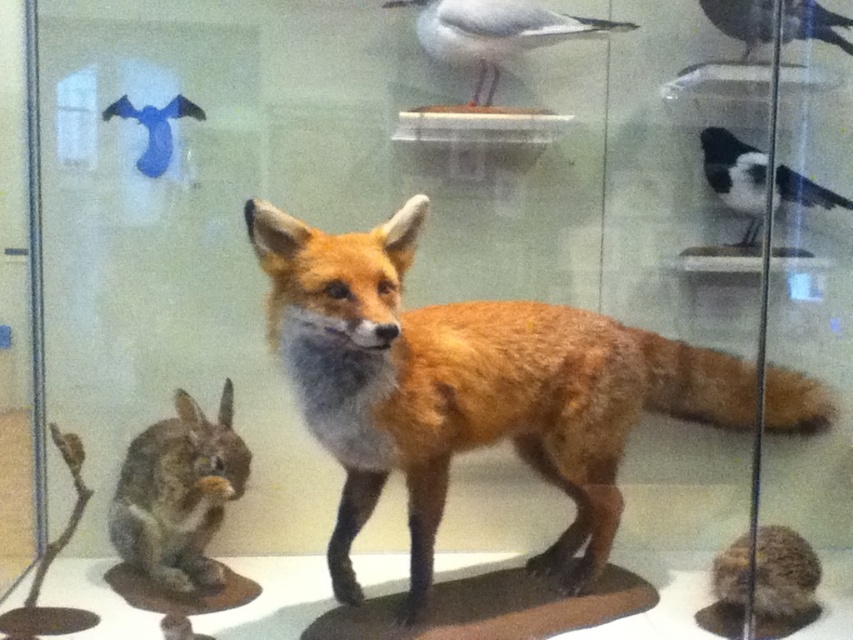
Can you confirm if shiny brown fur at center is positioned above black glossy bird at upper right?

No.

Is shiny brown fur at center in front of black glossy bird at upper right?

Yes.

Is point (318, 339) positioned after point (701, 147)?

No, it is not.

At what (x,y) coordinates should I click in order to perform the action: click on shiny brown fur at center. Please return your answer as a coordinate pair (x, y). The height and width of the screenshot is (640, 853). Looking at the image, I should click on (467, 387).

Who is more distant from viewer, (300, 234) or (410, 1)?

Point (410, 1)

Who is more forward, (563, 413) or (520, 13)?

→ Point (563, 413)

Find the location of `shiny brown fur at center`. shiny brown fur at center is located at coordinates (467, 387).

Consider the image. Who is lower down, white matte bird at upper center or black glossy bird at upper right?

black glossy bird at upper right is below.

Between white matte bird at upper center and black glossy bird at upper right, which one has more height?

Standing taller between the two is black glossy bird at upper right.

Is point (447, 12) in front of point (830, 193)?

Yes.

The height and width of the screenshot is (640, 853). In order to click on white matte bird at upper center in this screenshot , I will do (x=494, y=33).